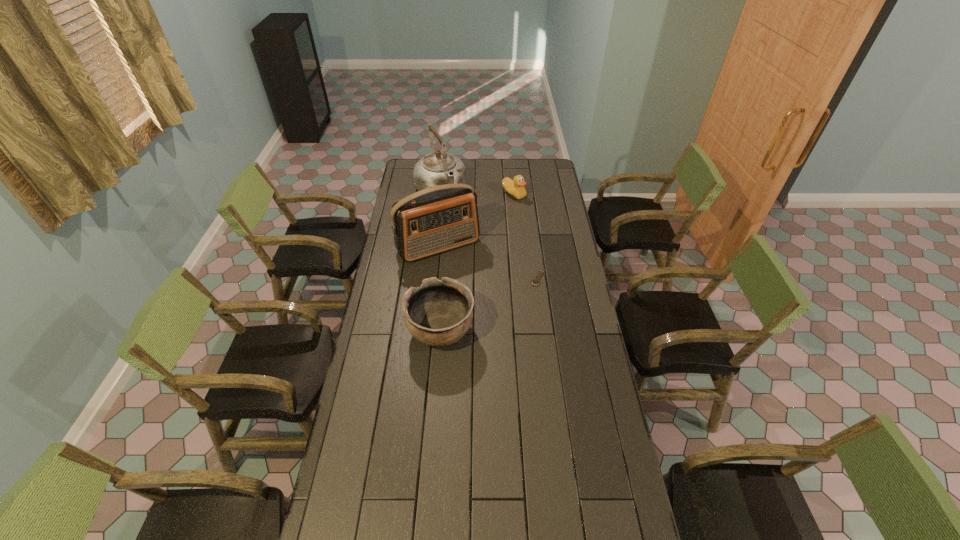
This screenshot has height=540, width=960. What are the coordinates of `free area in between the nearest object and the shortest object` in the screenshot? It's located at (490, 305).

I want to click on vacant area that lies between the second shortest object and the pottery, so click(x=477, y=263).

The width and height of the screenshot is (960, 540). In order to click on free space between the third tallest object and the second nearest object in this screenshot , I will do `click(490, 305)`.

Identify the location of empty space between the shortest object and the third farthest object. This screenshot has height=540, width=960. (489, 262).

Find the location of `vacant area between the second nearest object and the radio receiver`. vacant area between the second nearest object and the radio receiver is located at coordinates (489, 262).

Locate an element on the screen. The image size is (960, 540). free space between the kettle and the pottery is located at coordinates (441, 262).

At what (x,y) coordinates should I click in order to perform the action: click on object that ranks as the fourth closest to the kettle. Please return your answer as a coordinate pair (x, y). Looking at the image, I should click on (438, 313).

Find the location of a particular element. The width and height of the screenshot is (960, 540). object that can be found as the third closest to the third farthest object is located at coordinates (x=438, y=313).

Image resolution: width=960 pixels, height=540 pixels. Find the location of `vacant region that satisfies the following two spatial constraints: 1. on the front side of the duck; 2. on the right side of the kettle`. vacant region that satisfies the following two spatial constraints: 1. on the front side of the duck; 2. on the right side of the kettle is located at coordinates (441, 194).

Image resolution: width=960 pixels, height=540 pixels. Find the location of `vacant position in the image that satisfies the following two spatial constraints: 1. on the back side of the third shortest object; 2. on the right side of the shortest object`. vacant position in the image that satisfies the following two spatial constraints: 1. on the back side of the third shortest object; 2. on the right side of the shortest object is located at coordinates (445, 278).